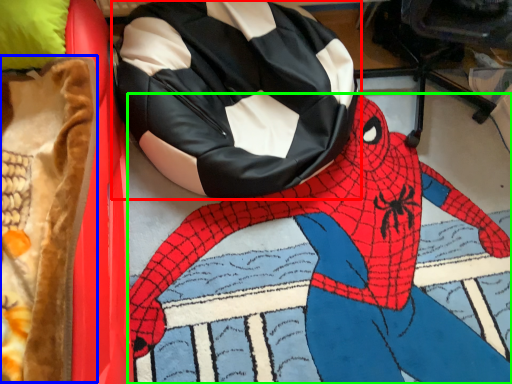
Question: Which object is the closest to the bean bag chair (highlighted by a red box)? Choose among these: blanket (highlighted by a blue box) or person (highlighted by a green box).

Choices:
 (A) blanket
 (B) person

Answer: (B)